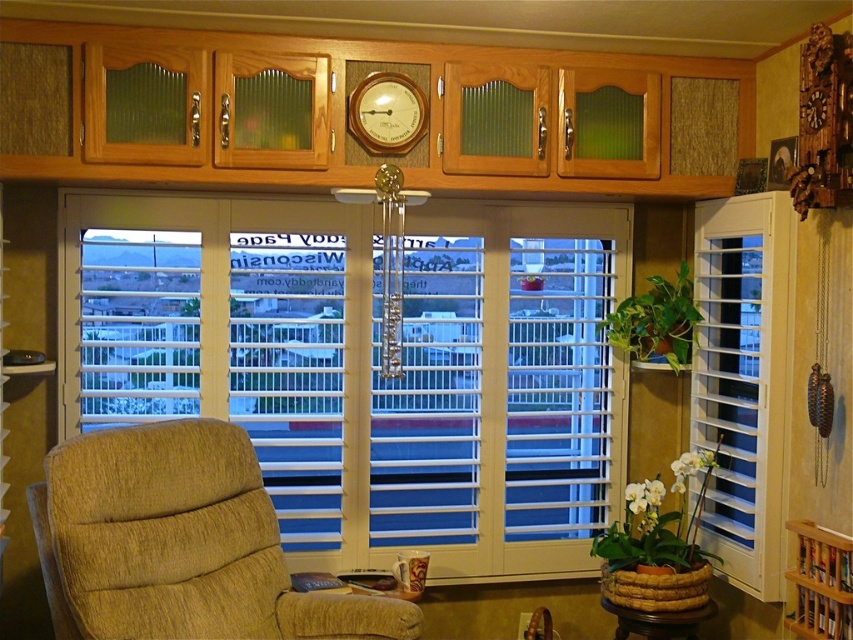
Question: Is beige fabric armchair at lower left closer to camera compared to white wood shutter at right?

Choices:
 (A) no
 (B) yes

Answer: (B)

Question: Can you confirm if beige fabric armchair at lower left is positioned below wooden clock at upper center?

Choices:
 (A) no
 (B) yes

Answer: (B)

Question: Which point is closer to the camera?

Choices:
 (A) coord(416,99)
 (B) coord(440,349)

Answer: (A)

Question: Based on their relative distances, which object is nearer to the beige fabric armchair at lower left?

Choices:
 (A) wooden clock at upper center
 (B) white wood blinds at center

Answer: (B)

Question: Which object is positioned closest to the white wood blinds at center?

Choices:
 (A) wooden clock at upper center
 (B) beige fabric armchair at lower left

Answer: (B)

Question: Observing the image, what is the correct spatial positioning of white wood shutter at right in reference to wooden clock at upper center?

Choices:
 (A) right
 (B) left

Answer: (A)